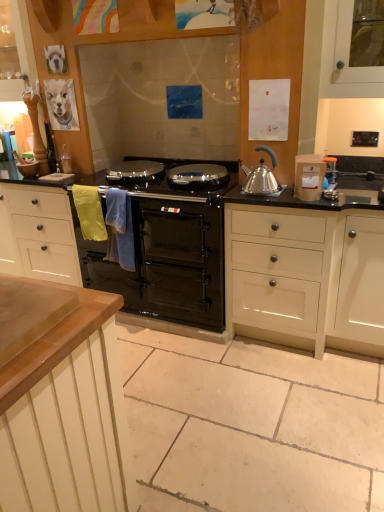
Question: Are black glass oven at center and wooden cabinet at upper left, placed as the second cabinetry when sorted from right to left, making contact?

Choices:
 (A) yes
 (B) no

Answer: (B)

Question: Is black glass oven at center oriented towards wooden cabinet at upper left, which is counted as the 2th cabinetry, starting from the bottom?

Choices:
 (A) yes
 (B) no

Answer: (B)

Question: Would you say black glass oven at center is outside wooden cabinet at upper left, which is the first cabinetry in top-to-bottom order?

Choices:
 (A) no
 (B) yes

Answer: (B)

Question: Can you confirm if black glass oven at center is shorter than wooden cabinet at upper left, which is the first cabinetry in top-to-bottom order?

Choices:
 (A) yes
 (B) no

Answer: (B)

Question: From a real-world perspective, is black glass oven at center physically above wooden cabinet at upper left, which is counted as the 2th cabinetry, starting from the bottom?

Choices:
 (A) yes
 (B) no

Answer: (B)

Question: From the image's perspective, is black glass oven at center on top of wooden cabinet at upper left, placed as the second cabinetry when sorted from right to left?

Choices:
 (A) yes
 (B) no

Answer: (B)

Question: Does black glass oven at center have a lesser width compared to white matte container at right?

Choices:
 (A) no
 (B) yes

Answer: (A)

Question: Is black glass oven at center oriented away from white matte container at right?

Choices:
 (A) no
 (B) yes

Answer: (A)

Question: Can you confirm if black glass oven at center is shorter than white matte container at right?

Choices:
 (A) yes
 (B) no

Answer: (B)

Question: From a real-world perspective, is black glass oven at center located higher than white matte container at right?

Choices:
 (A) yes
 (B) no

Answer: (B)

Question: Is black glass oven at center closer to the viewer compared to white matte container at right?

Choices:
 (A) no
 (B) yes

Answer: (A)

Question: Is black glass oven at center surrounding white matte container at right?

Choices:
 (A) yes
 (B) no

Answer: (B)

Question: Can you confirm if satin silver kettle at right is positioned to the left of wooden cabinet at upper left, placed as the second cabinetry when sorted from right to left?

Choices:
 (A) yes
 (B) no

Answer: (B)